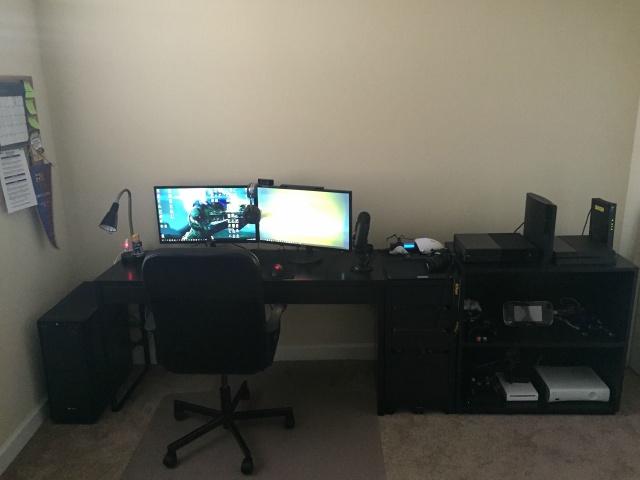
What are the coordinates of `desk chaie` in the screenshot? It's located at (210, 332).